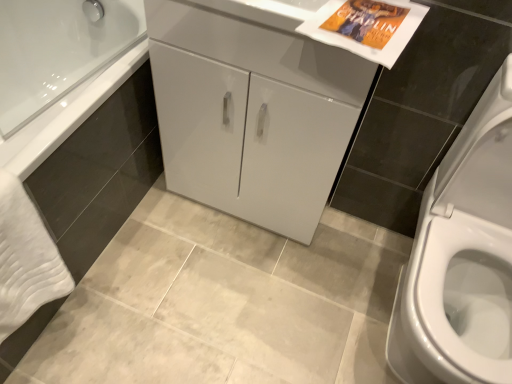
Question: Is the position of white glossy cabinet at center less distant than that of white soft towel at lower left?

Choices:
 (A) yes
 (B) no

Answer: (B)

Question: From the image's perspective, is white glossy cabinet at center above white soft towel at lower left?

Choices:
 (A) yes
 (B) no

Answer: (A)

Question: Considering the relative positions of white glossy cabinet at center and white soft towel at lower left in the image provided, is white glossy cabinet at center to the left of white soft towel at lower left from the viewer's perspective?

Choices:
 (A) yes
 (B) no

Answer: (B)

Question: Can you confirm if white glossy cabinet at center is thinner than white soft towel at lower left?

Choices:
 (A) yes
 (B) no

Answer: (B)

Question: From a real-world perspective, is white glossy cabinet at center physically below white soft towel at lower left?

Choices:
 (A) no
 (B) yes

Answer: (A)

Question: Do you think white glossy cabinet at center is within white glossy cabinet at center, or outside of it?

Choices:
 (A) inside
 (B) outside

Answer: (B)

Question: From the image's perspective, is white glossy cabinet at center above or below white glossy cabinet at center?

Choices:
 (A) below
 (B) above

Answer: (A)

Question: Is point (361, 86) closer or farther from the camera than point (195, 34)?

Choices:
 (A) closer
 (B) farther

Answer: (A)

Question: Is white glossy cabinet at center taller or shorter than white glossy cabinet at center?

Choices:
 (A) short
 (B) tall

Answer: (B)

Question: From their relative heights in the image, would you say white soft towel at lower left is taller or shorter than white glossy cabinet at center?

Choices:
 (A) tall
 (B) short

Answer: (A)

Question: Is point (24, 218) closer or farther from the camera than point (266, 54)?

Choices:
 (A) closer
 (B) farther

Answer: (A)

Question: Looking at the image, does white soft towel at lower left seem bigger or smaller compared to white glossy cabinet at center?

Choices:
 (A) small
 (B) big

Answer: (A)

Question: Is white soft towel at lower left inside the boundaries of white glossy cabinet at center, or outside?

Choices:
 (A) inside
 (B) outside

Answer: (B)

Question: From the image's perspective, is white soft towel at lower left positioned above or below white glossy cabinet at center?

Choices:
 (A) above
 (B) below

Answer: (B)

Question: Do you think white soft towel at lower left is within white glossy cabinet at center, or outside of it?

Choices:
 (A) inside
 (B) outside

Answer: (B)